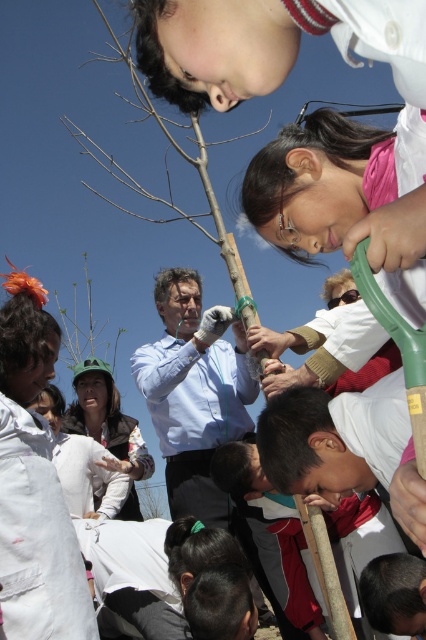
Question: Which point is farther to the camera?

Choices:
 (A) bare wood tree at center
 (B) white cotton shirt at lower left
 (C) green leafy plant at center
 (D) white fabric shirt at center

Answer: (C)

Question: Where is white cotton shirt at lower left located in relation to white fabric shirt at center in the image?

Choices:
 (A) right
 (B) left

Answer: (A)

Question: Estimate the real-world distances between objects in this image. Which object is farther from the bare wood tree at center?

Choices:
 (A) white cotton shirt at lower left
 (B) white fabric shirt at center
 (C) green leafy plant at center

Answer: (A)

Question: Which of these objects is positioned closest to the green leafy plant at center?

Choices:
 (A) white fabric shirt at center
 (B) white cotton shirt at lower left

Answer: (A)

Question: Does white cotton shirt at lower left have a smaller size compared to green leafy plant at center?

Choices:
 (A) no
 (B) yes

Answer: (B)

Question: Is white fabric shirt at center further to the viewer compared to green leafy plant at center?

Choices:
 (A) no
 (B) yes

Answer: (A)